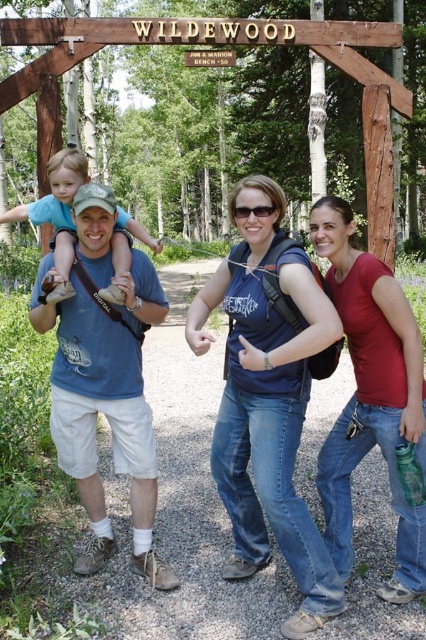
Is point (43, 317) positioned after point (109, 285)?

That is True.

From the picture: Does blue cotton t-shirt at center appear under matte blue shirt at center?

Yes.

Does point (164, 570) lie in front of point (48, 195)?

That is True.

I want to click on blue cotton t-shirt at center, so click(106, 404).

Is blue denim jeans at center positioned in front of matte red shirt at center?

That is True.

Between point (299, 522) and point (379, 416), which one is positioned behind?

The point (379, 416) is more distant.

This screenshot has width=426, height=640. In order to click on blue denim jeans at center in this screenshot , I will do `click(267, 401)`.

Is blue cotton t-shirt at center to the right of matte red shirt at center from the viewer's perspective?

Incorrect, blue cotton t-shirt at center is not on the right side of matte red shirt at center.

Who is taller, blue cotton t-shirt at center or matte red shirt at center?

Standing taller between the two is blue cotton t-shirt at center.

What are the coordinates of `blue cotton t-shirt at center` in the screenshot? It's located at (106, 404).